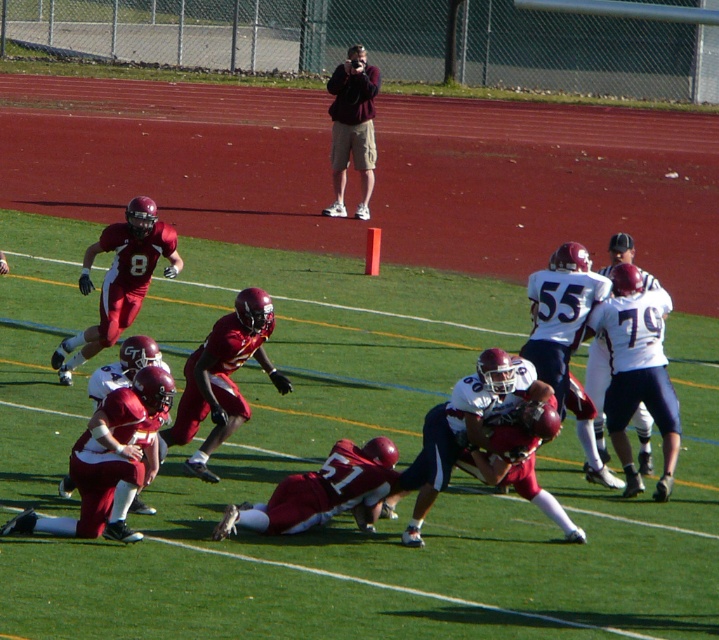
You are a referee observing the football game. You notice the matte red helmet at center and the maroon fabric jacket at upper center. Which object is closer to you?

The matte red helmet at center is closer to you because it is in front of the maroon fabric jacket at upper center.

You are a photographer standing at the edge of the field. You want to take a photo of the shiny red football players at center and the maroon fabric jacket at upper center. Which object will appear larger in your photo?

The shiny red football players at center will appear larger in the photo because they are closer to the viewer than the maroon fabric jacket at upper center.